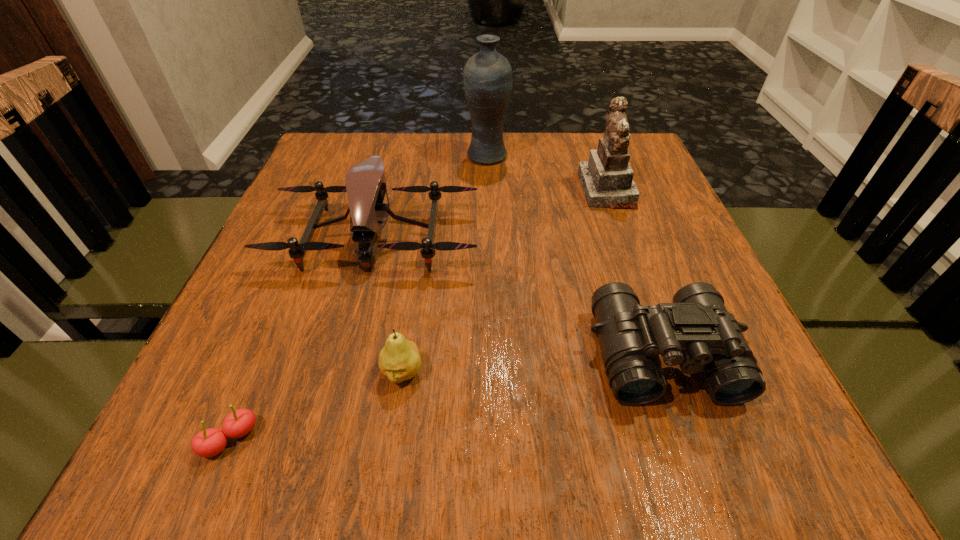
You are a GUI agent. You are given a task and a screenshot of the screen. Output one action in this format:
    pyautogui.click(x=<x>, y=<y>)
    Task: Click on the free spot between the pear and the farthest object
    
    Given the screenshot: What is the action you would take?
    pyautogui.click(x=444, y=264)

In order to click on object that stands as the fourth closest to the vase in this screenshot , I will do `click(399, 360)`.

Locate which object is the fourth closest to the fourth tallest object. Please provide its 2D coordinates. Your answer should be formatted as a tuple, i.e. [(x, y)], where the tuple contains the x and y coordinates of a point satisfying the conditions above.

[(210, 442)]

This screenshot has width=960, height=540. Find the location of `vacant point that satisfies the following two spatial constraints: 1. on the front-facing side of the second tallest object; 2. on the front-facing side of the fourth shortest object`. vacant point that satisfies the following two spatial constraints: 1. on the front-facing side of the second tallest object; 2. on the front-facing side of the fourth shortest object is located at coordinates (623, 237).

Where is `vacant point that satisfies the following two spatial constraints: 1. on the back side of the tallest object; 2. on the right side of the shortest object`? This screenshot has height=540, width=960. vacant point that satisfies the following two spatial constraints: 1. on the back side of the tallest object; 2. on the right side of the shortest object is located at coordinates (348, 156).

I want to click on free location that satisfies the following two spatial constraints: 1. on the front-facing side of the figurine; 2. through the lenses of the third shortest object, so click(665, 355).

Where is `vacant region that satisfies the following two spatial constraints: 1. on the front-facing side of the third tallest object; 2. on the right side of the pear`? The image size is (960, 540). vacant region that satisfies the following two spatial constraints: 1. on the front-facing side of the third tallest object; 2. on the right side of the pear is located at coordinates (341, 373).

Locate an element on the screen. The image size is (960, 540). free spot that satisfies the following two spatial constraints: 1. on the front-facing side of the third tallest object; 2. on the left side of the pear is located at coordinates (341, 373).